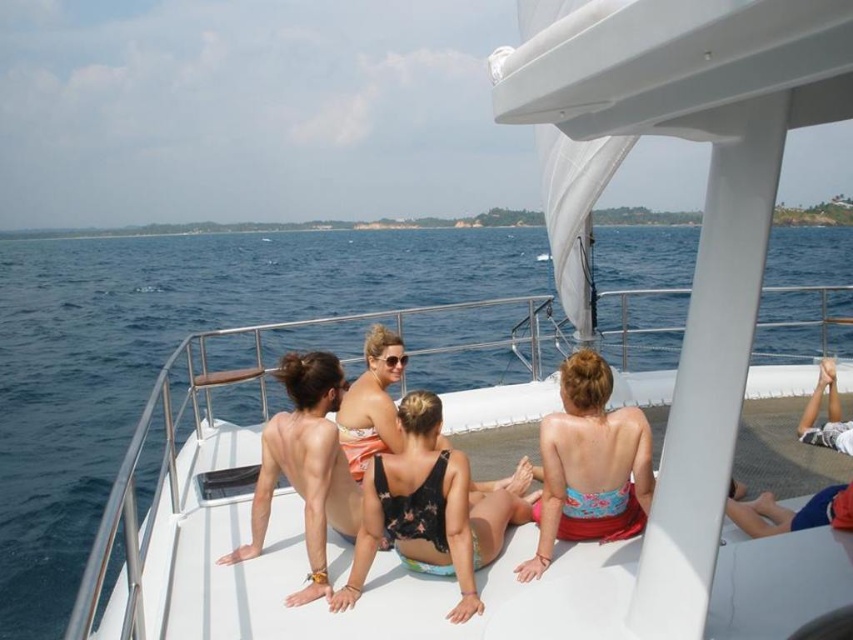
Question: Which point is closer to the camera?

Choices:
 (A) (54, 544)
 (B) (549, 502)
 (C) (520, 518)

Answer: (B)

Question: Which of the following is the farthest from the observer?

Choices:
 (A) (503, 499)
 (B) (819, 310)

Answer: (B)

Question: Is blue water at center thinner than blue floral bikini top at center?

Choices:
 (A) no
 (B) yes

Answer: (A)

Question: Which of the following is the farthest from the observer?

Choices:
 (A) blue floral bikini top at center
 (B) blue water at center

Answer: (A)

Question: Does blue water at center appear on the left side of black floral swimsuit at center?

Choices:
 (A) no
 (B) yes

Answer: (B)

Question: Can you confirm if blue water at center is bigger than tan skin at center?

Choices:
 (A) yes
 (B) no

Answer: (A)